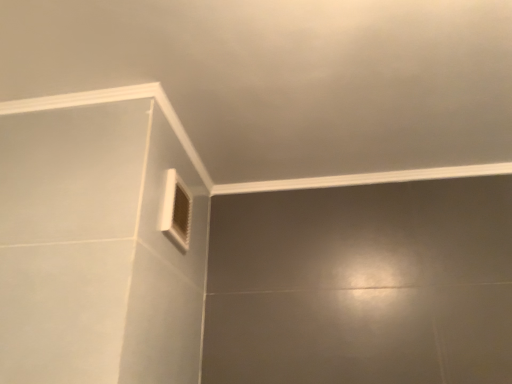
Image resolution: width=512 pixels, height=384 pixels. What do you see at coordinates (176, 210) in the screenshot? I see `white mesh vent at upper left` at bounding box center [176, 210].

You are a GUI agent. You are given a task and a screenshot of the screen. Output one action in this format:
    pyautogui.click(x=<x>, y=<y>)
    Task: Click on the white mesh vent at upper left
    The height and width of the screenshot is (384, 512).
    Given the screenshot: What is the action you would take?
    pyautogui.click(x=176, y=210)

Identify the location of white mesh vent at upper left. (176, 210).